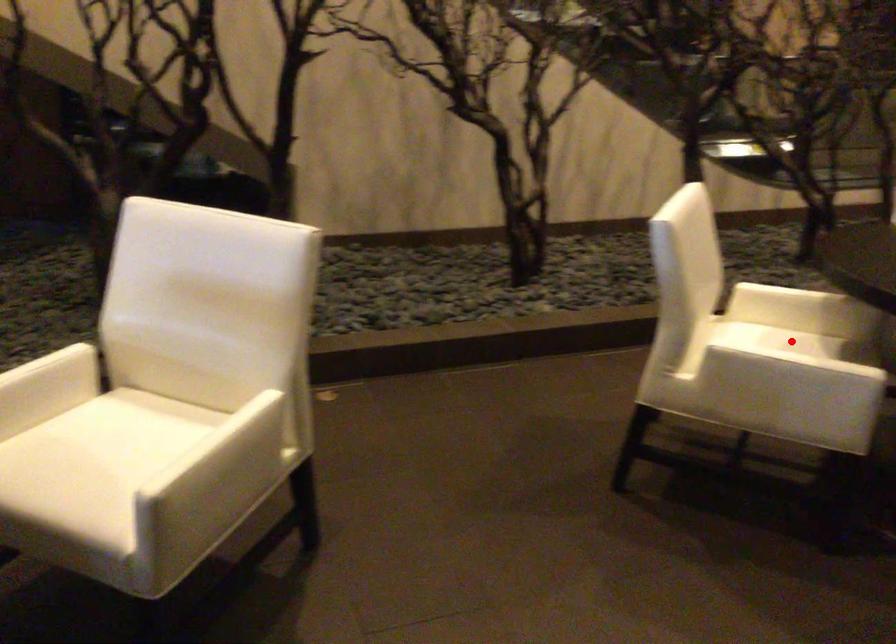
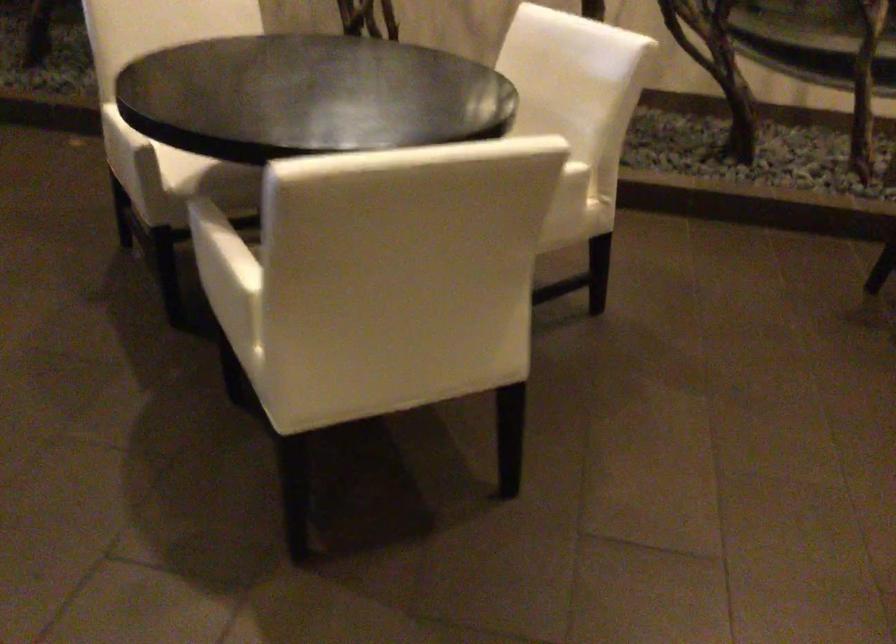
Question: I am providing you with two images of the same scene from different viewpoints. A red point is marked on the first image. Can you still see the location of the red point in image 2?

Choices:
 (A) Yes
 (B) No

Answer: (B)